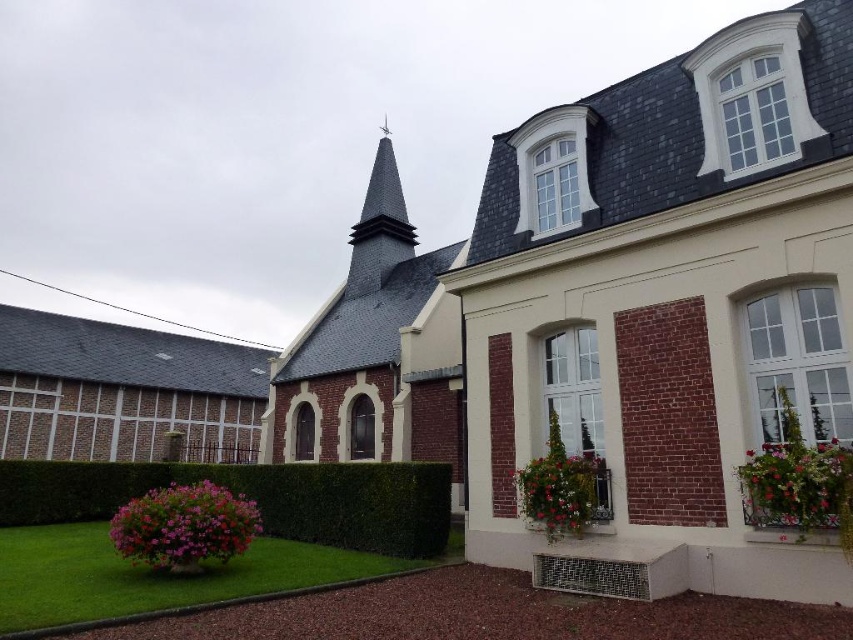
You are standing in front of the architectural scene and notice two pink flowers. One is the pink matte flower at lower left and the other is the pink fabric flower at lower right. Which one is closer to you?

The pink matte flower at lower left is closer to you since it is further to the viewer than the pink fabric flower at lower right.

You are a florist arranging flowers for a wedding. You have two options for centerpieces. The pink matte flower at lower left and the pink fabric flower at lower right. Which one should you choose if you want the centerpiece to take up more space on the table?

The pink fabric flower at lower right should be chosen because it occupies more space than the pink matte flower at lower left.